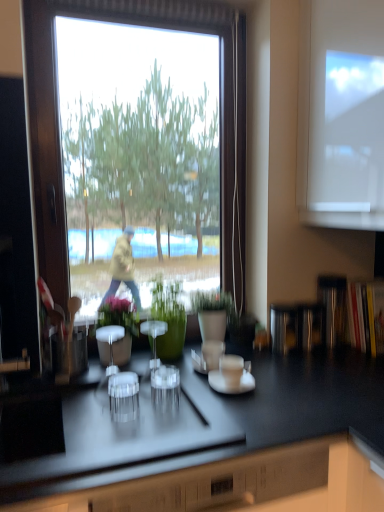
This screenshot has height=512, width=384. Identify the location of green glossy vase at center, acting as the third houseplant starting from the right. (120, 326).

From a real-world perspective, which is physically above, green matte plant at center, which is counted as the 1th houseplant, starting from the right, or green glossy vase at center, acting as the third houseplant starting from the right?

green matte plant at center, which is counted as the 1th houseplant, starting from the right, from a real-world perspective.

Which is behind, point (218, 323) or point (103, 342)?

The point (218, 323) is more distant.

Is green matte plant at center, arranged as the 3th houseplant when viewed from the left, to the left or to the right of green glossy vase at center, acting as the third houseplant starting from the right, in the image?

green matte plant at center, arranged as the 3th houseplant when viewed from the left, is to the right of green glossy vase at center, acting as the third houseplant starting from the right.

Between green matte plant at center, which is counted as the 1th houseplant, starting from the right, and green glossy vase at center, which is counted as the first houseplant, starting from the left, which one is positioned behind?

Positioned behind is green matte plant at center, which is counted as the 1th houseplant, starting from the right.

Is white glossy saucer at center touching green glossy vase at center, acting as the third houseplant starting from the right?

No, white glossy saucer at center is not with green glossy vase at center, acting as the third houseplant starting from the right.

Which object is closer to the camera taking this photo, white glossy saucer at center or green glossy vase at center, which is counted as the first houseplant, starting from the left?

white glossy saucer at center.

From the picture: Is green glossy vase at center, which is counted as the first houseplant, starting from the left, inside white glossy saucer at center?

No, green glossy vase at center, which is counted as the first houseplant, starting from the left, is located outside of white glossy saucer at center.

From a real-world perspective, which object rests below the other?

transparent plastic shot glass at center, from a real-world perspective.

Is clear glass salt shaker at center further to the viewer compared to transparent plastic shot glass at center?

Yes, clear glass salt shaker at center is behind transparent plastic shot glass at center.

Which object is positioned more to the left, clear glass salt shaker at center or transparent plastic shot glass at center?

Positioned to the left is clear glass salt shaker at center.

From the image's perspective, would you say clear glass salt shaker at center is positioned over transparent plastic shot glass at center?

Yes.

Between shiny black countertop at center and green matte vase at center, placed as the 2th houseplant when sorted from right to left, which one appears on the left side from the viewer's perspective?

shiny black countertop at center is more to the left.

Would you say shiny black countertop at center is inside or outside green matte vase at center, placed as the 2th houseplant when sorted from right to left?

shiny black countertop at center cannot be found inside green matte vase at center, placed as the 2th houseplant when sorted from right to left.

Which of these two, shiny black countertop at center or green matte vase at center, which is the second houseplant in left-to-right order, is smaller?

With smaller size is green matte vase at center, which is the second houseplant in left-to-right order.

Considering the points (156, 389) and (192, 298), which point is in front, point (156, 389) or point (192, 298)?

The point (156, 389) is more forward.

Considering the sizes of objects transparent plastic shot glass at center and green matte plant at center, which is counted as the 1th houseplant, starting from the right, in the image provided, who is taller, transparent plastic shot glass at center or green matte plant at center, which is counted as the 1th houseplant, starting from the right,?

green matte plant at center, which is counted as the 1th houseplant, starting from the right.

Is transparent plastic shot glass at center positioned with its back to green matte plant at center, which is counted as the 1th houseplant, starting from the right?

That's not correct — transparent plastic shot glass at center is not looking away from green matte plant at center, which is counted as the 1th houseplant, starting from the right.

From a real-world perspective, does transparent plastic shot glass at center stand above green matte plant at center, which is counted as the 1th houseplant, starting from the right?

Actually, transparent plastic shot glass at center is physically below green matte plant at center, which is counted as the 1th houseplant, starting from the right, in the real world.

Considering the relative sizes of green glossy vase at center, acting as the third houseplant starting from the right, and transparent plastic shot glass at center in the image provided, is green glossy vase at center, acting as the third houseplant starting from the right, shorter than transparent plastic shot glass at center?

In fact, green glossy vase at center, acting as the third houseplant starting from the right, may be taller than transparent plastic shot glass at center.

Between point (109, 345) and point (166, 407), which one is positioned in front?

The point (166, 407) is in front.

Which object is wider, green glossy vase at center, which is counted as the first houseplant, starting from the left, or transparent plastic shot glass at center?

With larger width is green glossy vase at center, which is counted as the first houseplant, starting from the left.

What's the angular difference between green glossy vase at center, acting as the third houseplant starting from the right, and transparent plastic shot glass at center's facing directions?

green glossy vase at center, acting as the third houseplant starting from the right, and transparent plastic shot glass at center are facing 1.51 degrees away from each other.

Is green matte plant at center, arranged as the 3th houseplant when viewed from the left, not within white glossy saucer at center?

Yes, green matte plant at center, arranged as the 3th houseplant when viewed from the left, is outside of white glossy saucer at center.

Considering the positions of objects green matte plant at center, arranged as the 3th houseplant when viewed from the left, and white glossy saucer at center in the image provided, who is more to the left, green matte plant at center, arranged as the 3th houseplant when viewed from the left, or white glossy saucer at center?

green matte plant at center, arranged as the 3th houseplant when viewed from the left, is more to the left.

Considering the sizes of green matte plant at center, arranged as the 3th houseplant when viewed from the left, and white glossy saucer at center in the image, is green matte plant at center, arranged as the 3th houseplant when viewed from the left, taller or shorter than white glossy saucer at center?

Considering their sizes, green matte plant at center, arranged as the 3th houseplant when viewed from the left, has more height than white glossy saucer at center.

Image resolution: width=384 pixels, height=512 pixels. Identify the location of the 2nd houseplant in front of the green matte plant at center, which is counted as the 1th houseplant, starting from the right, counting from the anchor's position. (120, 326).

You are a GUI agent. You are given a task and a screenshot of the screen. Output one action in this format:
    pyautogui.click(x=<x>, y=<y>)
    Task: Click on the houseplant that is the 1st object above the white glossy saucer at center (from a real-world perspective)
    This screenshot has height=512, width=384.
    Given the screenshot: What is the action you would take?
    pyautogui.click(x=120, y=326)

Looking at the image, which one is located closer to shiny black countertop at center, clear glass salt shaker at center or green matte vase at center, which is the second houseplant in left-to-right order?

Based on the image, green matte vase at center, which is the second houseplant in left-to-right order, appears to be nearer to shiny black countertop at center.

Based on their spatial positions, is green matte plant at center, arranged as the 3th houseplant when viewed from the left, or clear glass salt shaker at center closer to transparent plastic shot glass at center?

The object closer to transparent plastic shot glass at center is clear glass salt shaker at center.

When comparing their distances from white glossy saucer at center, does green matte vase at center, which is the second houseplant in left-to-right order, or green glossy vase at center, acting as the third houseplant starting from the right, seem closer?

green matte vase at center, which is the second houseplant in left-to-right order, is positioned closer to the anchor white glossy saucer at center.

Estimate the real-world distances between objects in this image. Which object is further from green glossy vase at center, acting as the third houseplant starting from the right, green matte plant at center, arranged as the 3th houseplant when viewed from the left, or green matte vase at center, placed as the 2th houseplant when sorted from right to left?

green matte plant at center, arranged as the 3th houseplant when viewed from the left, is further to green glossy vase at center, acting as the third houseplant starting from the right.

From the image, which object appears to be nearer to clear glass salt shaker at center, transparent plastic shot glass at center or green matte vase at center, placed as the 2th houseplant when sorted from right to left?

The object closer to clear glass salt shaker at center is green matte vase at center, placed as the 2th houseplant when sorted from right to left.

Considering their positions, is green matte plant at center, which is counted as the 1th houseplant, starting from the right, positioned further to green matte vase at center, placed as the 2th houseplant when sorted from right to left, than clear glass salt shaker at center?

Based on the image, green matte plant at center, which is counted as the 1th houseplant, starting from the right, appears to be further to green matte vase at center, placed as the 2th houseplant when sorted from right to left.

Based on their spatial positions, is green matte plant at center, arranged as the 3th houseplant when viewed from the left, or clear glass salt shaker at center closer to white glossy saucer at center?

clear glass salt shaker at center is positioned closer to the anchor white glossy saucer at center.

Looking at the image, which one is located closer to transparent plastic shot glass at center, green matte vase at center, placed as the 2th houseplant when sorted from right to left, or clear glass salt shaker at center?

The object closer to transparent plastic shot glass at center is clear glass salt shaker at center.

Image resolution: width=384 pixels, height=512 pixels. Find the location of `shot glass between clear glass salt shaker at center and white glossy saucer at center`. shot glass between clear glass salt shaker at center and white glossy saucer at center is located at coordinates (165, 392).

Locate an element on the screen. The width and height of the screenshot is (384, 512). appliance between green glossy vase at center, acting as the third houseplant starting from the right, and white glossy saucer at center is located at coordinates (154, 337).

This screenshot has width=384, height=512. In order to click on shot glass between shiny black countertop at center and green matte plant at center, which is counted as the 1th houseplant, starting from the right, from front to back in this screenshot , I will do `click(165, 392)`.

The image size is (384, 512). Find the location of `saucer located between shiny black countertop at center and green matte plant at center, which is counted as the 1th houseplant, starting from the right, in the depth direction`. saucer located between shiny black countertop at center and green matte plant at center, which is counted as the 1th houseplant, starting from the right, in the depth direction is located at coordinates (231, 383).